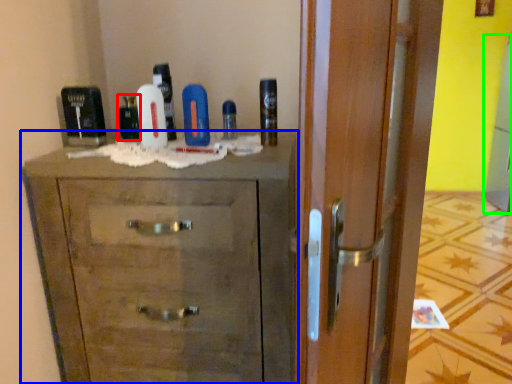
Question: Estimate the real-world distances between objects in this image. Which object is closer to mouthwash (highlighted by a red box), chest of drawers (highlighted by a blue box) or screen door (highlighted by a green box)?

Choices:
 (A) chest of drawers
 (B) screen door

Answer: (A)